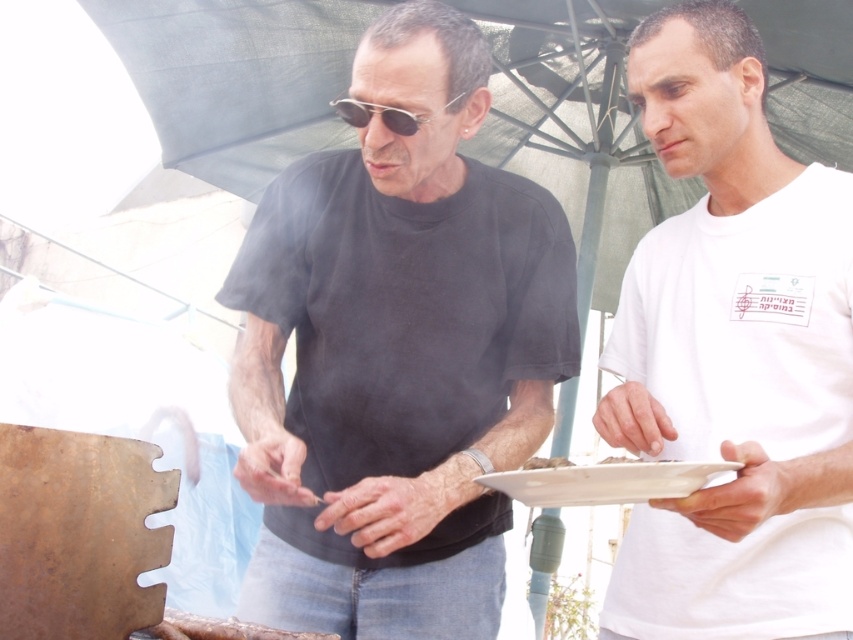
Describe the element at coordinates (396, 353) in the screenshot. I see `black matte shirt at center` at that location.

Who is higher up, black matte shirt at center or white cotton t-shirt at center?

white cotton t-shirt at center is above.

Which is behind, point (294, 550) or point (804, 486)?

Positioned behind is point (294, 550).

Where is `black matte shirt at center`? Image resolution: width=853 pixels, height=640 pixels. black matte shirt at center is located at coordinates (396, 353).

Who is more distant from viewer, (659, 77) or (393, 125)?

Positioned behind is point (659, 77).

Is point (817, 604) closer to camera compared to point (384, 115)?

No, it is behind (384, 115).

Locate an element on the screen. white cotton t-shirt at center is located at coordinates (733, 355).

Can you confirm if black matte shirt at center is positioned below sunglasses at center?

Correct, black matte shirt at center is located below sunglasses at center.

Image resolution: width=853 pixels, height=640 pixels. What do you see at coordinates (396, 353) in the screenshot? I see `black matte shirt at center` at bounding box center [396, 353].

Locate an element on the screen. black matte shirt at center is located at coordinates (396, 353).